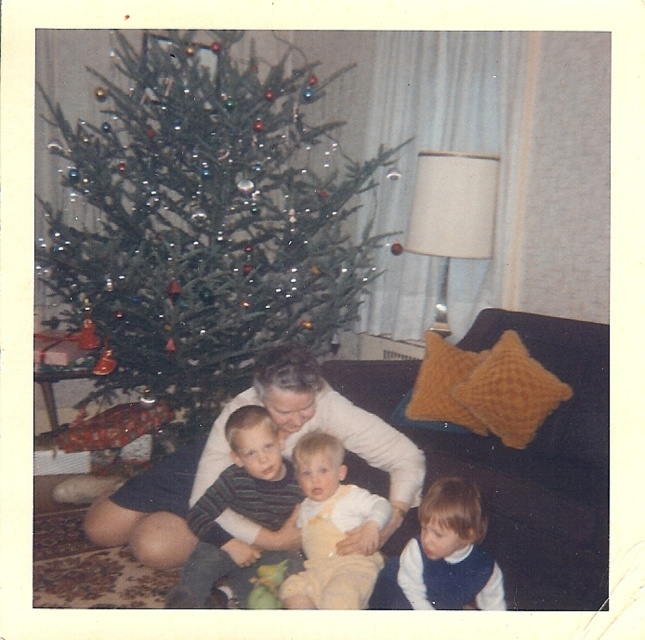
Can you confirm if yellow cotton onesie at center is positioned above light brown hair at lower center?

Yes, yellow cotton onesie at center is above light brown hair at lower center.

Can you confirm if yellow cotton onesie at center is thinner than light brown hair at lower center?

Yes, yellow cotton onesie at center is thinner than light brown hair at lower center.

This screenshot has width=645, height=640. I want to click on yellow cotton onesie at center, so click(x=332, y=531).

Is striped cotton shirt at center wider than light brown hair at lower center?

In fact, striped cotton shirt at center might be narrower than light brown hair at lower center.

What do you see at coordinates (239, 512) in the screenshot? I see `striped cotton shirt at center` at bounding box center [239, 512].

Locate an element on the screen. The height and width of the screenshot is (640, 645). striped cotton shirt at center is located at coordinates (239, 512).

Does point (608, 392) come behind point (255, 522)?

Yes.

Looking at this image, does dark brown fabric couch at center have a greater width compared to striped cotton shirt at center?

Yes.

What do you see at coordinates (524, 460) in the screenshot? This screenshot has width=645, height=640. I see `dark brown fabric couch at center` at bounding box center [524, 460].

The height and width of the screenshot is (640, 645). I want to click on dark brown fabric couch at center, so pos(524,460).